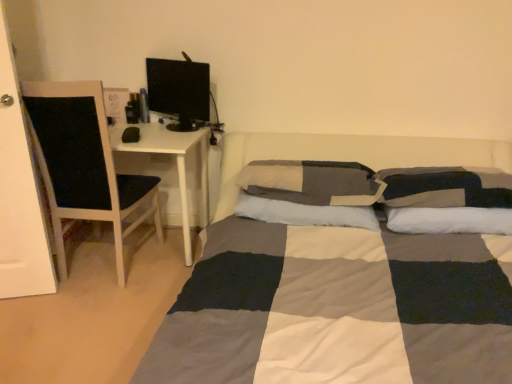
Question: Does checkered fabric pillow at center, placed as the 2th pillow when sorted from right to left, have a smaller size compared to white wood chair at left?

Choices:
 (A) yes
 (B) no

Answer: (A)

Question: From a real-world perspective, is checkered fabric pillow at center, marked as the 2th pillow in a left-to-right arrangement, under white wood chair at left?

Choices:
 (A) no
 (B) yes

Answer: (A)

Question: Can you confirm if checkered fabric pillow at center, placed as the 2th pillow when sorted from right to left, is wider than white wood chair at left?

Choices:
 (A) no
 (B) yes

Answer: (A)

Question: Considering the relative sizes of checkered fabric pillow at center, marked as the 2th pillow in a left-to-right arrangement, and white wood chair at left in the image provided, is checkered fabric pillow at center, marked as the 2th pillow in a left-to-right arrangement, thinner than white wood chair at left?

Choices:
 (A) yes
 (B) no

Answer: (A)

Question: Considering the relative sizes of checkered fabric pillow at center, placed as the 2th pillow when sorted from right to left, and white wood chair at left in the image provided, is checkered fabric pillow at center, placed as the 2th pillow when sorted from right to left, shorter than white wood chair at left?

Choices:
 (A) no
 (B) yes

Answer: (B)

Question: Would you say checkered fabric pillow at center, placed as the 2th pillow when sorted from right to left, contains white wood chair at left?

Choices:
 (A) yes
 (B) no

Answer: (B)

Question: Is checkered fabric pillow at right, which is the third pillow in left-to-right order, taller than white wood chair at left?

Choices:
 (A) yes
 (B) no

Answer: (B)

Question: Is checkered fabric pillow at right, which is the third pillow in left-to-right order, smaller than white wood chair at left?

Choices:
 (A) no
 (B) yes

Answer: (B)

Question: Considering the relative sizes of checkered fabric pillow at right, the first pillow from the right, and white wood chair at left in the image provided, is checkered fabric pillow at right, the first pillow from the right, thinner than white wood chair at left?

Choices:
 (A) yes
 (B) no

Answer: (A)

Question: From a real-world perspective, is checkered fabric pillow at right, which is the third pillow in left-to-right order, over white wood chair at left?

Choices:
 (A) no
 (B) yes

Answer: (B)

Question: Can you confirm if checkered fabric pillow at right, the first pillow from the right, is shorter than white wood chair at left?

Choices:
 (A) no
 (B) yes

Answer: (B)

Question: Is checkered fabric pillow at right, the first pillow from the right, turned away from white wood chair at left?

Choices:
 (A) no
 (B) yes

Answer: (A)

Question: From a real-world perspective, is soft cotton pillow at center, which is the 3th pillow in right-to-left order, below black glossy computer monitor at upper left?

Choices:
 (A) no
 (B) yes

Answer: (B)